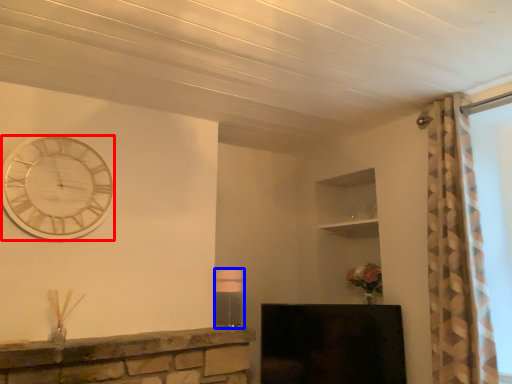
Question: Which object appears farthest to the camera in this image, wall clock (highlighted by a red box) or lamp (highlighted by a blue box)?

Choices:
 (A) wall clock
 (B) lamp

Answer: (B)